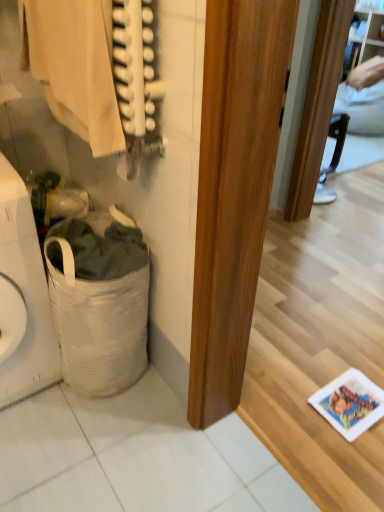
This screenshot has height=512, width=384. Describe the element at coordinates (23, 298) in the screenshot. I see `white woven laundry basket at lower left` at that location.

Locate an element on the screen. This screenshot has height=512, width=384. light beige fabric at upper left is located at coordinates (74, 66).

You are a GUI agent. You are given a task and a screenshot of the screen. Output one action in this format:
    pyautogui.click(x=<x>, y=<y>)
    Task: Click on the white woven laundry basket at lower left
    
    Given the screenshot: What is the action you would take?
    pyautogui.click(x=23, y=298)

Who is bigger, white fabric laundry basket at lower left or white woven laundry basket at lower left?

With larger size is white woven laundry basket at lower left.

Can you confirm if white fabric laundry basket at lower left is wider than white woven laundry basket at lower left?

In fact, white fabric laundry basket at lower left might be narrower than white woven laundry basket at lower left.

Is point (123, 295) farther from camera compared to point (26, 340)?

No, it is not.

Is white fabric laundry basket at lower left inside the boundaries of white woven laundry basket at lower left, or outside?

white fabric laundry basket at lower left lies outside white woven laundry basket at lower left.

Is point (117, 103) closer to camera compared to point (114, 390)?

Yes.

From a real-world perspective, is light beige fabric at upper left physically below white fabric laundry basket at lower left?

No, from a real-world perspective, light beige fabric at upper left is not under white fabric laundry basket at lower left.

Which of these two, light beige fabric at upper left or white fabric laundry basket at lower left, stands taller?

white fabric laundry basket at lower left is taller.

Is light beige fabric at upper left to the left or to the right of white woven laundry basket at lower left in the image?

Based on their positions, light beige fabric at upper left is located to the right of white woven laundry basket at lower left.

Which of these two, light beige fabric at upper left or white woven laundry basket at lower left, is bigger?

white woven laundry basket at lower left.

Locate an element on the screen. Image resolution: width=384 pixels, height=512 pixels. clothing positioned vertically above the white woven laundry basket at lower left (from a real-world perspective) is located at coordinates (74, 66).

From the image's perspective, who appears lower, light beige fabric at upper left or white woven laundry basket at lower left?

white woven laundry basket at lower left.

From the picture: Is white fabric laundry basket at lower left next to light beige fabric at upper left and touching it?

No, white fabric laundry basket at lower left is not next to light beige fabric at upper left.

Can you confirm if white fabric laundry basket at lower left is shorter than light beige fabric at upper left?

No.

Is white fabric laundry basket at lower left outside of light beige fabric at upper left?

Yes.

From the image's perspective, is white fabric laundry basket at lower left located beneath light beige fabric at upper left?

Yes, from the image's perspective, white fabric laundry basket at lower left is beneath light beige fabric at upper left.

From the image's perspective, is white woven laundry basket at lower left on top of white fabric laundry basket at lower left?

Yes, from the image's perspective, white woven laundry basket at lower left is on top of white fabric laundry basket at lower left.

Which is in front, point (19, 222) or point (138, 304)?

The point (19, 222) is more forward.

Is white woven laundry basket at lower left aimed at white fabric laundry basket at lower left?

No.

Considering the relative sizes of white woven laundry basket at lower left and white fabric laundry basket at lower left in the image provided, is white woven laundry basket at lower left taller than white fabric laundry basket at lower left?

Indeed, white woven laundry basket at lower left has a greater height compared to white fabric laundry basket at lower left.

Is white woven laundry basket at lower left positioned before light beige fabric at upper left?

No, white woven laundry basket at lower left is behind light beige fabric at upper left.

Considering the points (0, 341) and (46, 27), which point is behind, point (0, 341) or point (46, 27)?

Point (0, 341)

From a real-world perspective, is white woven laundry basket at lower left beneath light beige fabric at upper left?

Correct, in the physical world, white woven laundry basket at lower left is lower than light beige fabric at upper left.

Would you say light beige fabric at upper left is part of white woven laundry basket at lower left's contents?

Actually, light beige fabric at upper left is outside white woven laundry basket at lower left.

The height and width of the screenshot is (512, 384). Find the location of `laundry basket behind the white woven laundry basket at lower left`. laundry basket behind the white woven laundry basket at lower left is located at coordinates (98, 307).

Where is `clothing that appears on the left of white fabric laundry basket at lower left`? The width and height of the screenshot is (384, 512). clothing that appears on the left of white fabric laundry basket at lower left is located at coordinates (74, 66).

Based on their spatial positions, is white woven laundry basket at lower left or light beige fabric at upper left further from white fabric laundry basket at lower left?

Among the two, light beige fabric at upper left is located further to white fabric laundry basket at lower left.

Based on their spatial positions, is light beige fabric at upper left or white fabric laundry basket at lower left closer to white woven laundry basket at lower left?

Based on the image, white fabric laundry basket at lower left appears to be nearer to white woven laundry basket at lower left.

Which object lies nearer to the anchor point light beige fabric at upper left, white fabric laundry basket at lower left or white woven laundry basket at lower left?

Based on the image, white woven laundry basket at lower left appears to be nearer to light beige fabric at upper left.

Which object lies nearer to the anchor point white fabric laundry basket at lower left, light beige fabric at upper left or white woven laundry basket at lower left?

The object closer to white fabric laundry basket at lower left is white woven laundry basket at lower left.

From the image, which object appears to be farther from white woven laundry basket at lower left, white fabric laundry basket at lower left or light beige fabric at upper left?

light beige fabric at upper left.

Considering their positions, is white woven laundry basket at lower left positioned further to light beige fabric at upper left than white fabric laundry basket at lower left?

white fabric laundry basket at lower left.

At what (x,y) coordinates should I click in order to perform the action: click on appliance that lies between light beige fabric at upper left and white fabric laundry basket at lower left from top to bottom. Please return your answer as a coordinate pair (x, y). This screenshot has height=512, width=384. Looking at the image, I should click on (23, 298).